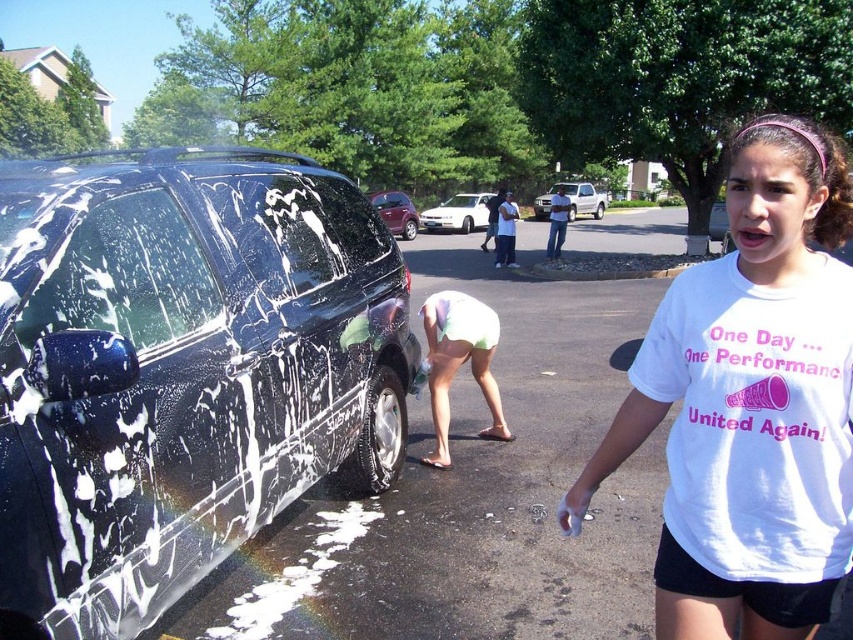
Is point (666, 349) positioned before point (575, 189)?

That is True.

Based on the photo, does white cotton t-shirt at center have a lesser width compared to white matte truck at center?

Yes.

Identify the location of white cotton t-shirt at center. (750, 403).

Locate an element on the screen. This screenshot has height=640, width=853. white cotton t-shirt at center is located at coordinates (750, 403).

Does shiny black suv at left have a larger size compared to shiny red car at center?

No.

This screenshot has width=853, height=640. Describe the element at coordinates (181, 369) in the screenshot. I see `shiny black suv at left` at that location.

Does point (331, 413) come closer to viewer compared to point (410, 209)?

Yes, point (331, 413) is in front of point (410, 209).

This screenshot has height=640, width=853. What are the coordinates of `shiny black suv at left` in the screenshot? It's located at (181, 369).

Does light green shorts at lower center have a greater height compared to shiny red car at center?

In fact, light green shorts at lower center may be shorter than shiny red car at center.

Is point (437, 403) closer to camera compared to point (369, 198)?

Yes, point (437, 403) is closer to viewer.

I want to click on light green shorts at lower center, so click(x=459, y=362).